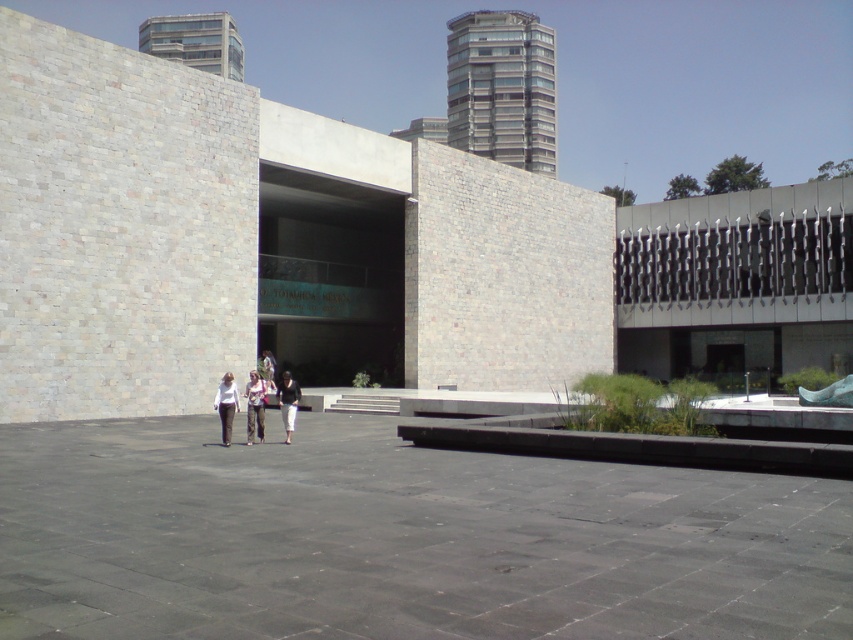
Question: Which object appears farthest from the camera in this image?

Choices:
 (A) black concrete courtyard at center
 (B) light brown leather jacket at center
 (C) black matte pants at center
 (D) white matte pants at center

Answer: (B)

Question: Does black concrete courtyard at center have a greater width compared to light brown pants at center?

Choices:
 (A) yes
 (B) no

Answer: (A)

Question: Is black concrete courtyard at center positioned behind light brown pants at center?

Choices:
 (A) yes
 (B) no

Answer: (B)

Question: Does white matte pants at center appear under light brown leather jacket at center?

Choices:
 (A) no
 (B) yes

Answer: (B)

Question: Among these objects, which one is farthest from the camera?

Choices:
 (A) light brown pants at center
 (B) light brown leather jacket at center
 (C) black concrete courtyard at center

Answer: (B)

Question: Which point is farther to the camera?

Choices:
 (A) black concrete courtyard at center
 (B) black matte pants at center

Answer: (B)